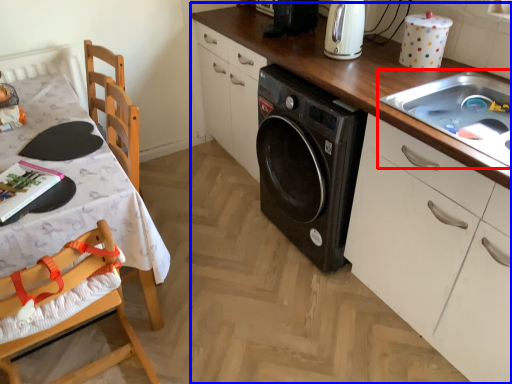
Question: Which object appears closest to the camera in this image, sink (highlighted by a red box) or countertop (highlighted by a blue box)?

Choices:
 (A) sink
 (B) countertop

Answer: (B)